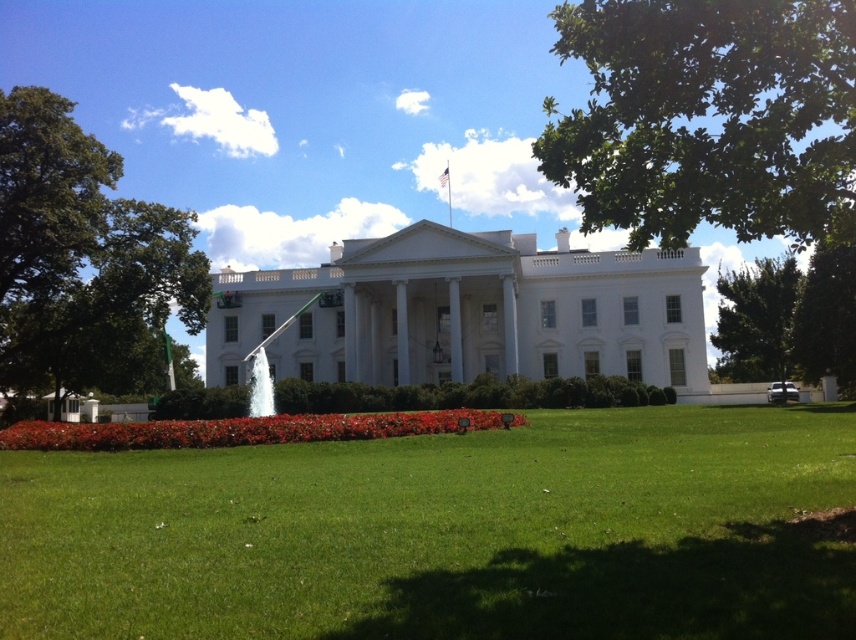
Question: Estimate the real-world distances between objects in this image. Which object is farther from the green leafy tree at upper right?

Choices:
 (A) green leafy tree at left
 (B) green leafy tree at right

Answer: (A)

Question: Can you confirm if green leafy tree at left is positioned to the left of green leafy tree at right?

Choices:
 (A) no
 (B) yes

Answer: (B)

Question: Which point is farther to the camera?

Choices:
 (A) green leafy tree at right
 (B) green leafy tree at left

Answer: (A)

Question: Observing the image, what is the correct spatial positioning of green leafy tree at upper right in reference to green leafy tree at right?

Choices:
 (A) above
 (B) below

Answer: (A)

Question: Does green grass at center have a greater width compared to green leafy tree at right?

Choices:
 (A) yes
 (B) no

Answer: (B)

Question: Among these points, which one is farthest from the camera?

Choices:
 (A) (27, 280)
 (B) (771, 308)
 (C) (824, 240)
 (D) (681, 600)

Answer: (A)